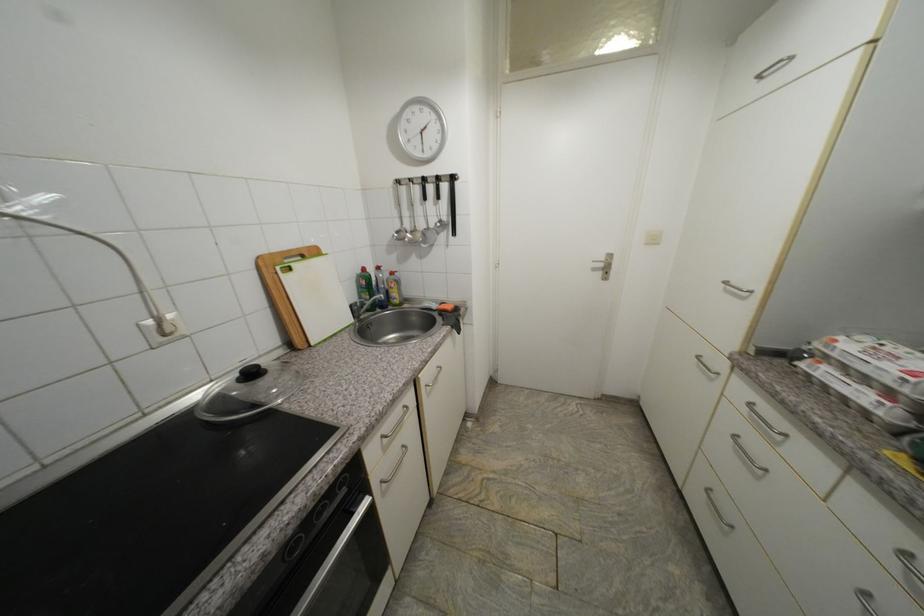
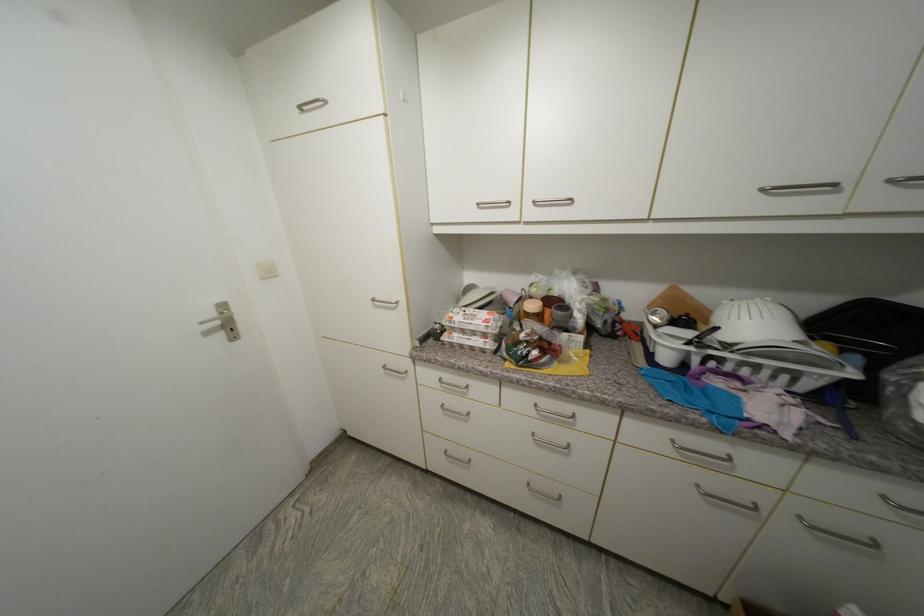
In the second image, find the point that corresponds to pixel 609 261 in the first image.

(220, 315)